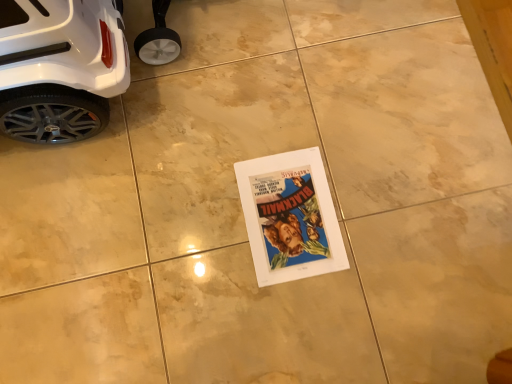
The width and height of the screenshot is (512, 384). I want to click on vacant space situated above vibrant paper movie poster at center (from a real-world perspective), so click(x=291, y=216).